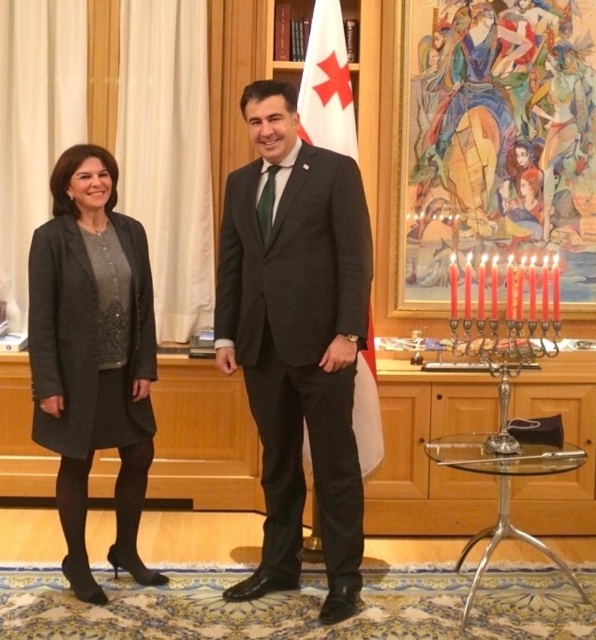
Does dark gray wool coat at center appear under white fabric flag at center?

Yes, dark gray wool coat at center is below white fabric flag at center.

Does dark gray wool coat at center have a lesser height compared to white fabric flag at center?

In fact, dark gray wool coat at center may be taller than white fabric flag at center.

Image resolution: width=596 pixels, height=640 pixels. In order to click on dark gray wool coat at center in this screenshot , I will do `click(299, 330)`.

This screenshot has width=596, height=640. I want to click on dark gray wool coat at center, so click(299, 330).

Is the position of black wool suit at center less distant than that of matte black coat at left?

Yes, it is.

Who is shorter, black wool suit at center or matte black coat at left?

matte black coat at left

Where is `black wool suit at center`? This screenshot has height=640, width=596. black wool suit at center is located at coordinates pyautogui.click(x=296, y=337).

The image size is (596, 640). Find the location of `black wool suit at center`. black wool suit at center is located at coordinates (296, 337).

Is point (132, 369) farther from camera compared to point (257, 592)?

Yes, it is.

Does point (280, 122) come in front of point (278, 241)?

That is True.

Where is `dark gray wool coat at center`? This screenshot has width=596, height=640. dark gray wool coat at center is located at coordinates (299, 330).

This screenshot has height=640, width=596. What are the coordinates of `dark gray wool coat at center` in the screenshot? It's located at (299, 330).